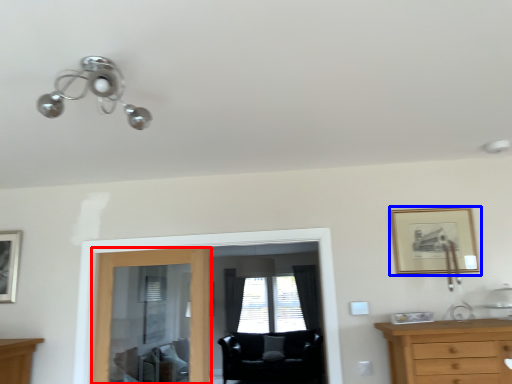
Question: Among these objects, which one is nearest to the camera, door (highlighted by a red box) or picture frame (highlighted by a blue box)?

Choices:
 (A) door
 (B) picture frame

Answer: (B)